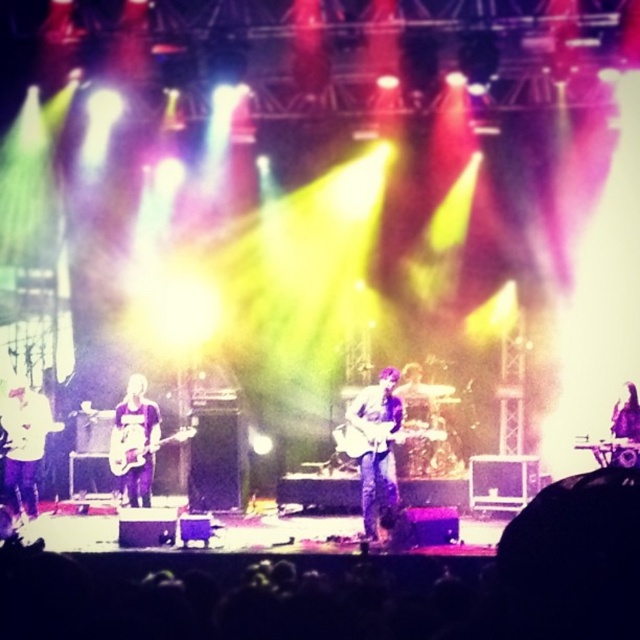
The height and width of the screenshot is (640, 640). What do you see at coordinates (376, 445) in the screenshot?
I see `shiny silver guitar at center` at bounding box center [376, 445].

Can you confirm if shiny silver guitar at center is positioned to the left of purple fabric guitar at center?

No, shiny silver guitar at center is not to the left of purple fabric guitar at center.

Identify the location of shiny silver guitar at center. (376, 445).

Is matte white shirt at left positioned behind glossy electric guitar at center?

That is True.

Measure the distance between point [32,426] and camera.

Point [32,426] is 9.01 meters from camera.

Image resolution: width=640 pixels, height=640 pixels. Describe the element at coordinates (24, 445) in the screenshot. I see `matte white shirt at left` at that location.

Where is `matte white shirt at left`? Image resolution: width=640 pixels, height=640 pixels. matte white shirt at left is located at coordinates (24, 445).

From the picture: Is purple fabric guitar at center to the left of glossy electric guitar at center from the viewer's perspective?

Yes, purple fabric guitar at center is to the left of glossy electric guitar at center.

Can you confirm if purple fabric guitar at center is thinner than glossy electric guitar at center?

Yes.

Find the location of a particular element. purple fabric guitar at center is located at coordinates (134, 440).

Locate an element on the screen. purple fabric guitar at center is located at coordinates (x=134, y=440).